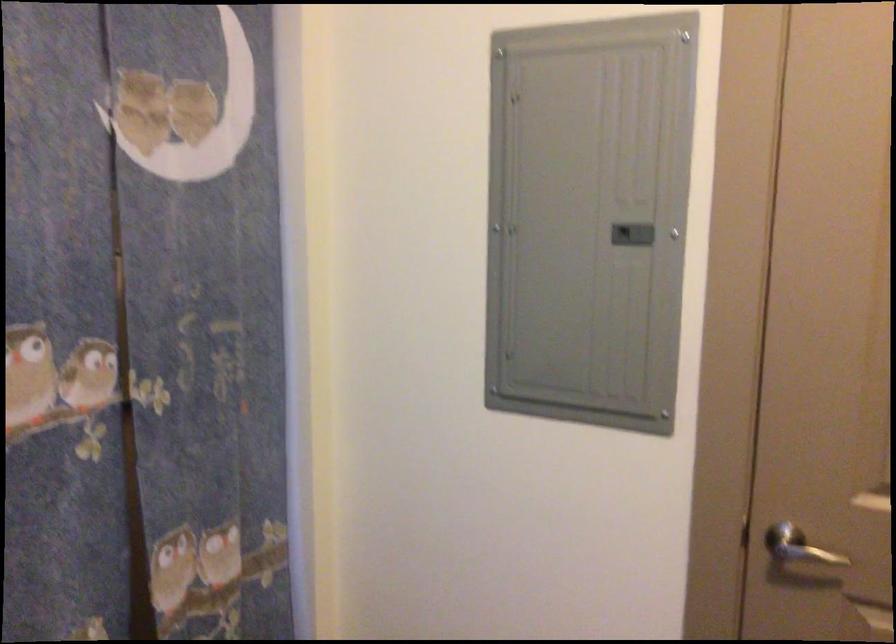
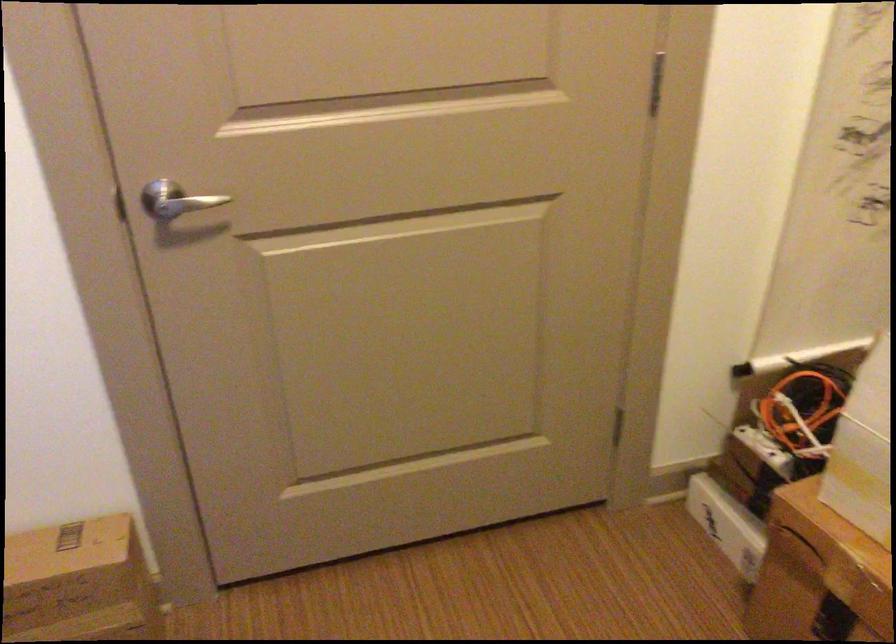
How did the camera likely rotate?

The camera's rotation is toward right-down.